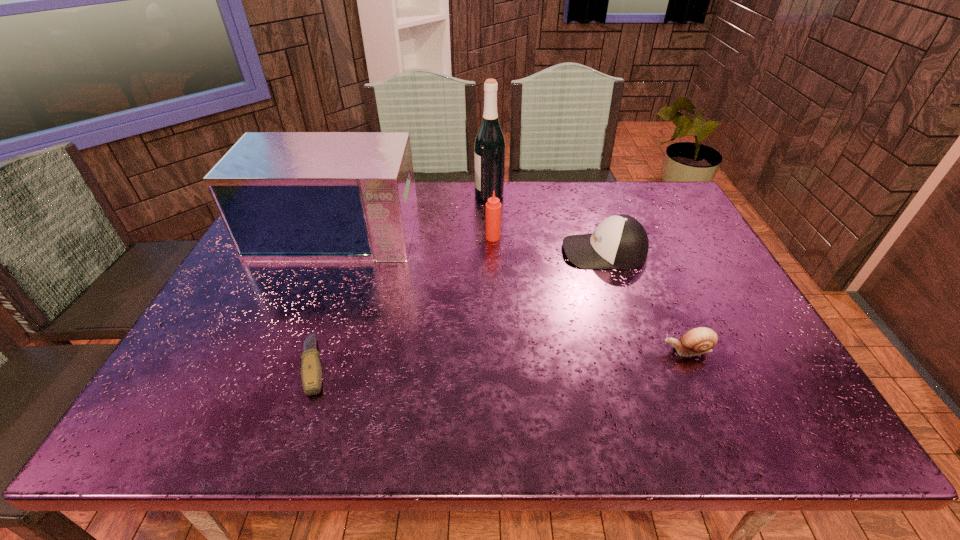
At what (x,y) coordinates should I click in order to perform the action: click on blank space that satisfies the following two spatial constraints: 1. on the front-facing side of the shortest object; 2. on the left side of the microwave oven. Please return your answer as a coordinate pair (x, y). Image resolution: width=960 pixels, height=540 pixels. Looking at the image, I should click on (282, 365).

The height and width of the screenshot is (540, 960). I want to click on blank space that satisfies the following two spatial constraints: 1. on the label of the tallest object; 2. on the right side of the Tabasco sauce, so click(x=491, y=237).

At what (x,y) coordinates should I click in order to perform the action: click on vacant region that satisfies the following two spatial constraints: 1. on the front-facing side of the shortest object; 2. on the right side of the microwave oven. Please return your answer as a coordinate pair (x, y). Looking at the image, I should click on (282, 365).

Locate an element on the screen. This screenshot has width=960, height=540. free spot that satisfies the following two spatial constraints: 1. on the front panel of the fourth tallest object; 2. on the front side of the shortest object is located at coordinates (642, 365).

Identify the location of free space in the image that satisfies the following two spatial constraints: 1. on the label of the wine bottle; 2. on the left side of the Tabasco sauce. [x=491, y=237].

The height and width of the screenshot is (540, 960). In order to click on vacant position in the image that satisfies the following two spatial constraints: 1. on the front-facing side of the shortest object; 2. on the left side of the microwave oven in this screenshot , I will do `click(282, 365)`.